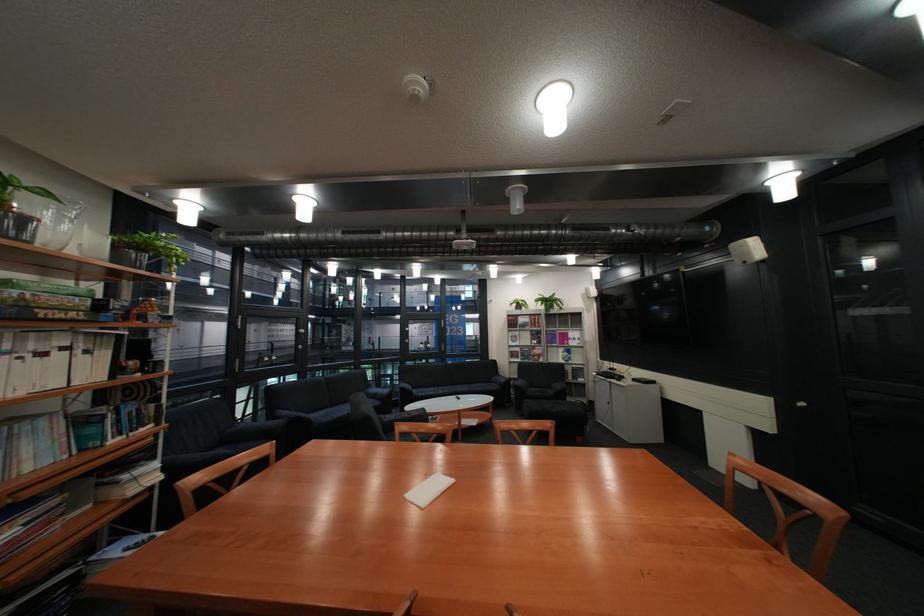
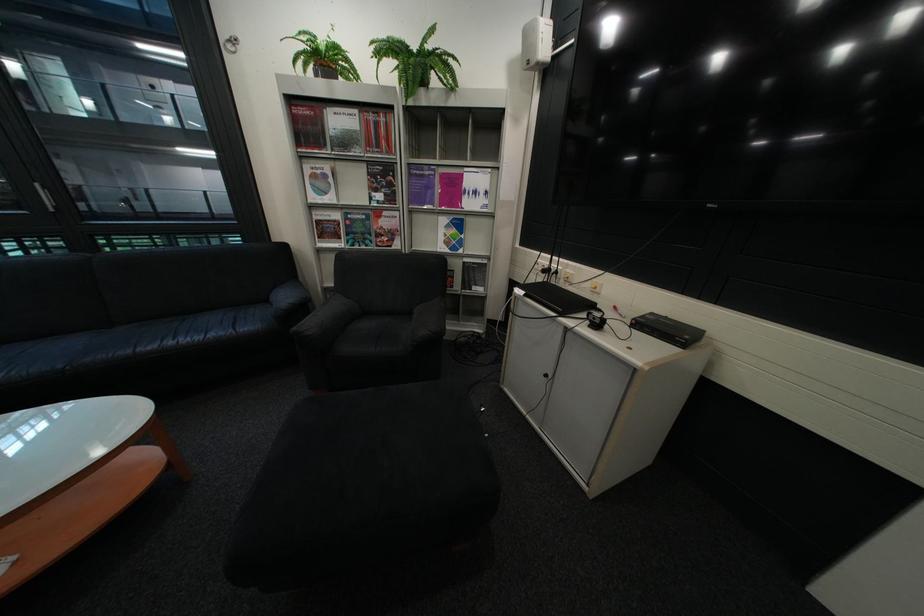
Question: I am providing you with two images of the same scene from different viewpoints. After the viewpoint changes to image2, which objects are now occluded?

Choices:
 (A) potted fern plant
 (B) sofa armrest
 (C) small black camera
 (D) none of these

Answer: (D)